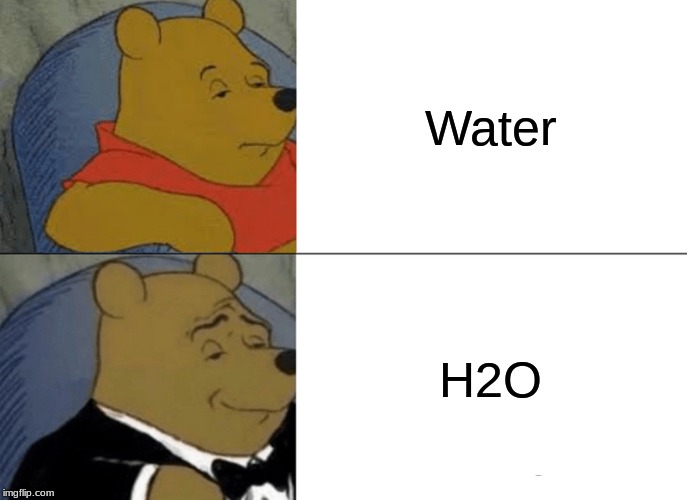
Where is `couch`? The width and height of the screenshot is (687, 500). couch is located at coordinates (44, 372), (62, 308), (63, 154), (76, 76).